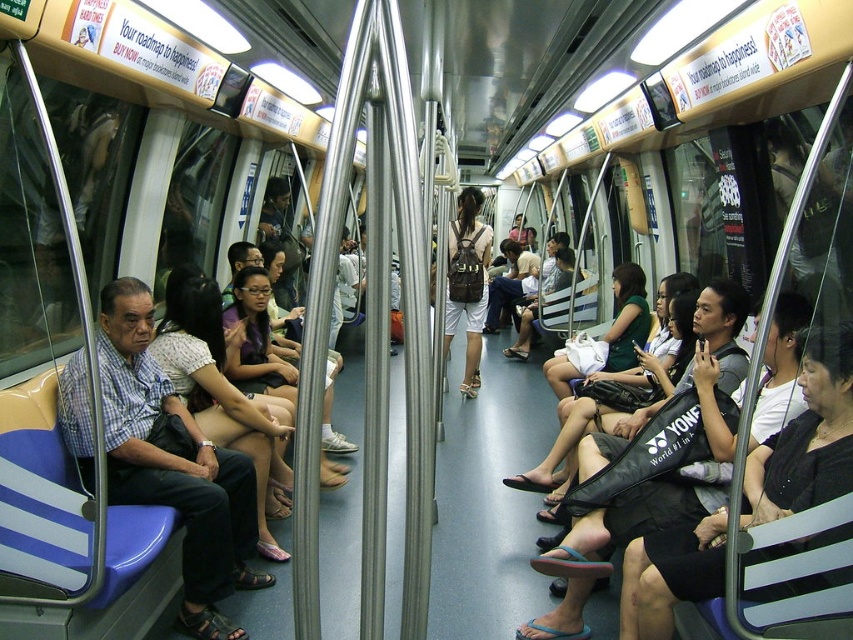
You are a passenger on a subway train and you see a black fabric bag at center and a matte white blouse at center. Which item is nearer to you?

The black fabric bag at center is closer to the viewer than the matte white blouse at center.

You are a passenger on a crowded subway train and need to reach your destination. You see a blue fabric seat at left and a matte white blouse at center. Given that you have a 12 inch wide bag, can you safely place your bag between these two items without it overlapping?

The blue fabric seat at left is 13.68 inches away from the matte white blouse at center. Since your bag is 12 inches wide, there is enough space to place it between them without overlapping.